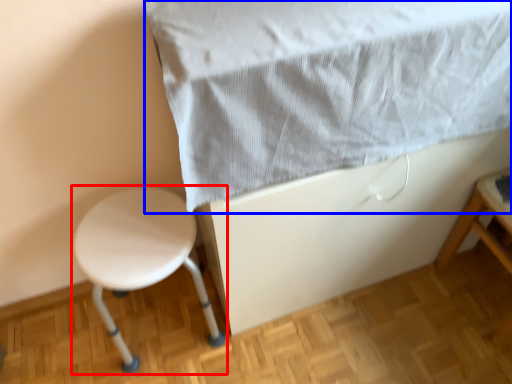
Question: Which object appears closest to the camera in this image, stool (highlighted by a red box) or sheet (highlighted by a blue box)?

Choices:
 (A) stool
 (B) sheet

Answer: (B)